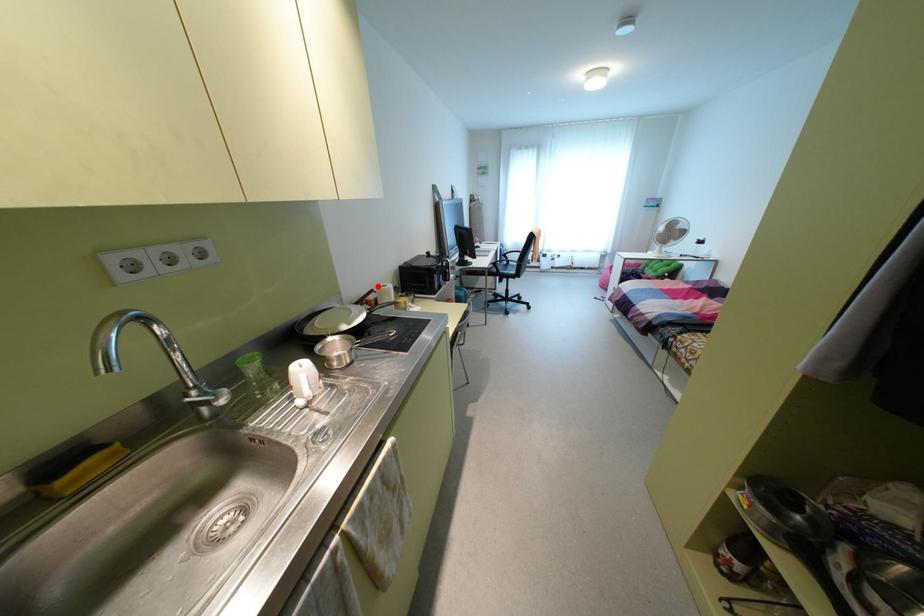
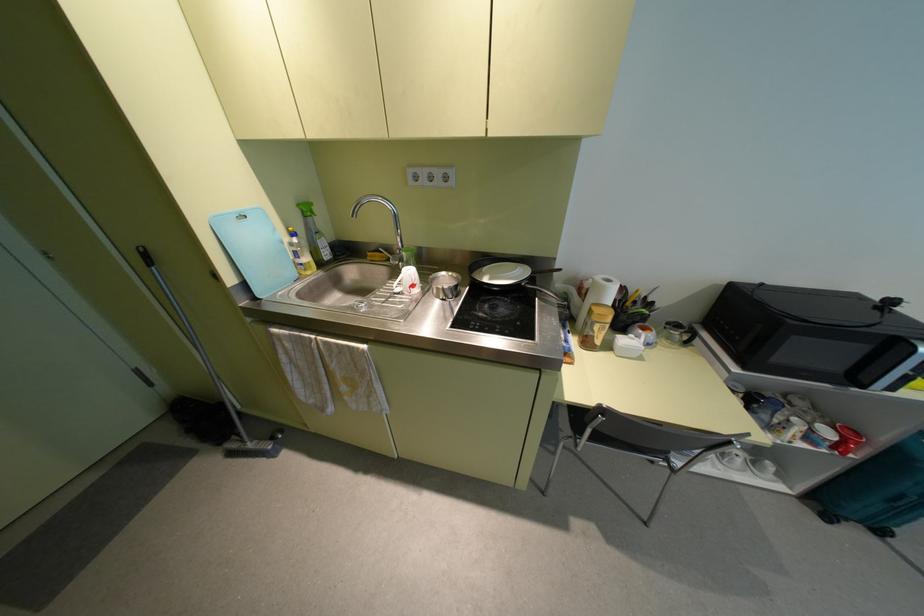
Question: I am providing you with two images of the same scene from different viewpoints. A red point is shown in image1. For the corresponding object point in image2, is it positioned nearer or farther from the camera?

Choices:
 (A) Nearer
 (B) Farther

Answer: (B)